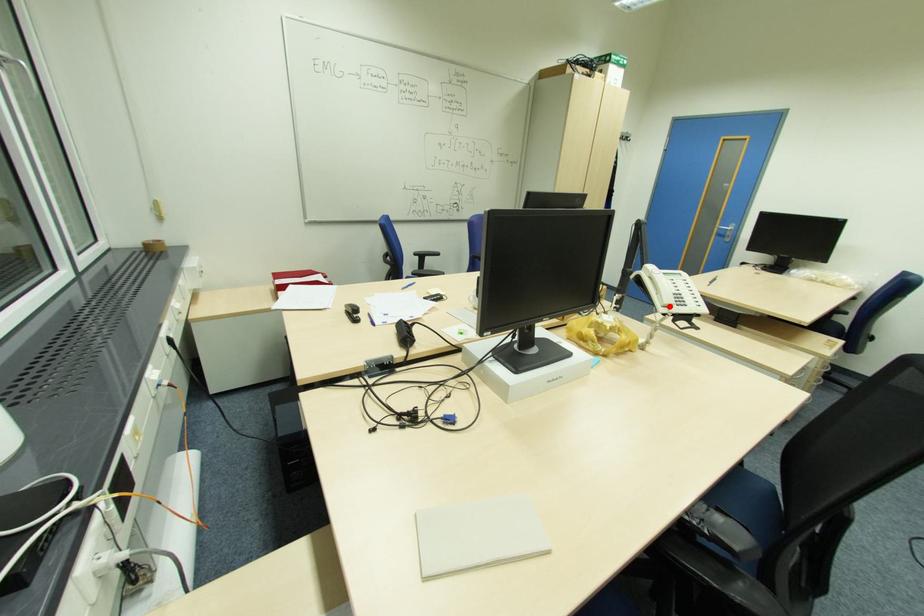
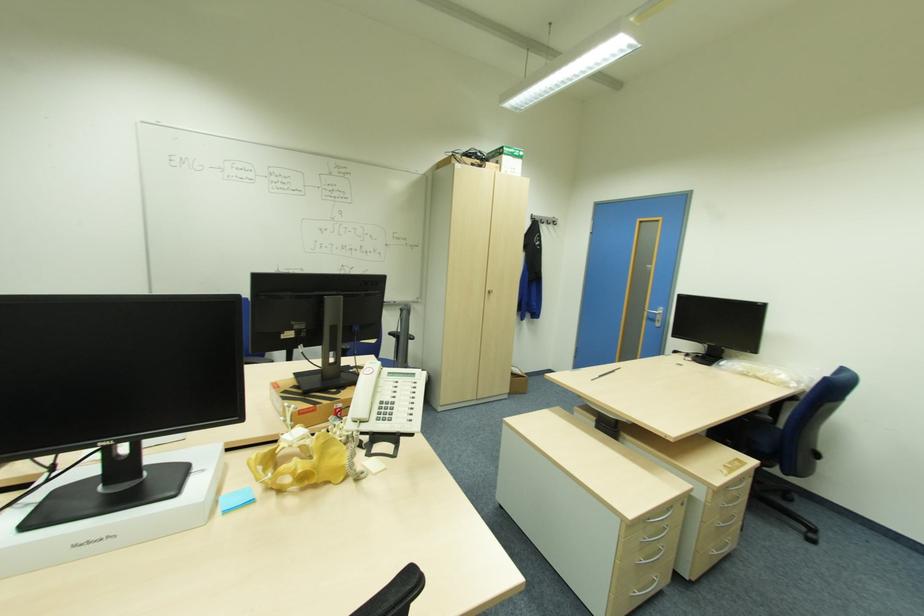
Question: I am providing you with two images of the same scene from different viewpoints. Given a red point in image1, look at the same physical point in image2. Is it:

Choices:
 (A) Closer to the viewpoint
 (B) Farther from the viewpoint

Answer: (B)